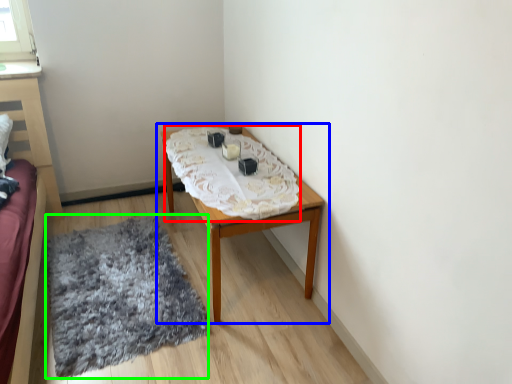
Question: Estimate the real-world distances between objects in this image. Which object is farther from blanket (highlighted by a red box), table (highlighted by a blue box) or mat (highlighted by a green box)?

Choices:
 (A) table
 (B) mat

Answer: (B)